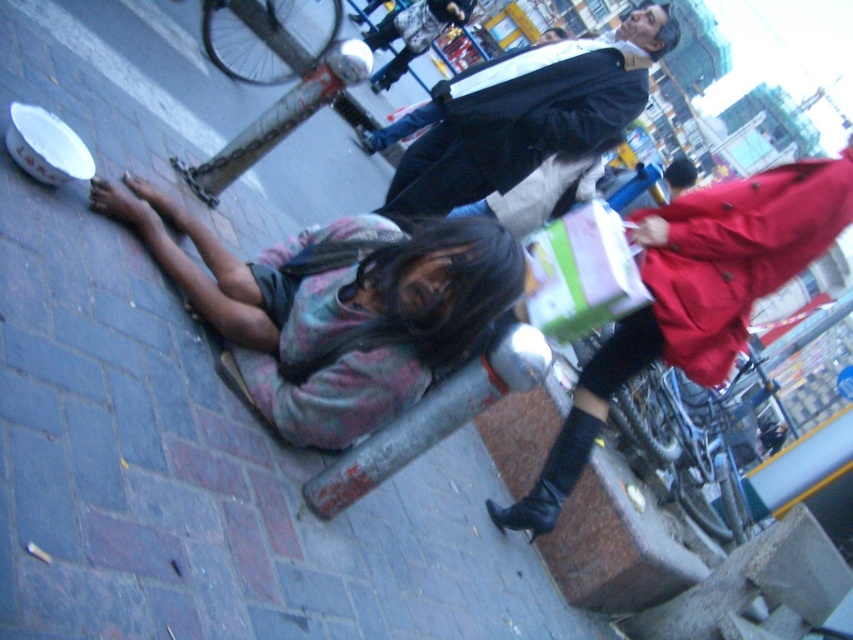
Can you confirm if brick pavement at lower left is bigger than dark blue leather jacket at upper center?

Correct, brick pavement at lower left is larger in size than dark blue leather jacket at upper center.

Does point (114, 42) come farther from viewer compared to point (450, 140)?

No, it is not.

Locate an element on the screen. brick pavement at lower left is located at coordinates (199, 394).

Does multicolored fabric at lower left appear on the left side of dark blue leather jacket at upper center?

Yes, multicolored fabric at lower left is to the left of dark blue leather jacket at upper center.

This screenshot has height=640, width=853. What do you see at coordinates (334, 308) in the screenshot?
I see `multicolored fabric at lower left` at bounding box center [334, 308].

Who is more distant from viewer, (422, 289) or (553, 74)?

Point (553, 74)

I want to click on multicolored fabric at lower left, so click(x=334, y=308).

Is point (325, 602) farther from viewer compared to point (135, 205)?

No, (325, 602) is closer to viewer.

Can you confirm if brick pavement at lower left is wider than multicolored fabric at lower left?

Correct, the width of brick pavement at lower left exceeds that of multicolored fabric at lower left.

Does point (187, 531) come in front of point (105, 205)?

Yes.

This screenshot has height=640, width=853. I want to click on brick pavement at lower left, so click(x=199, y=394).